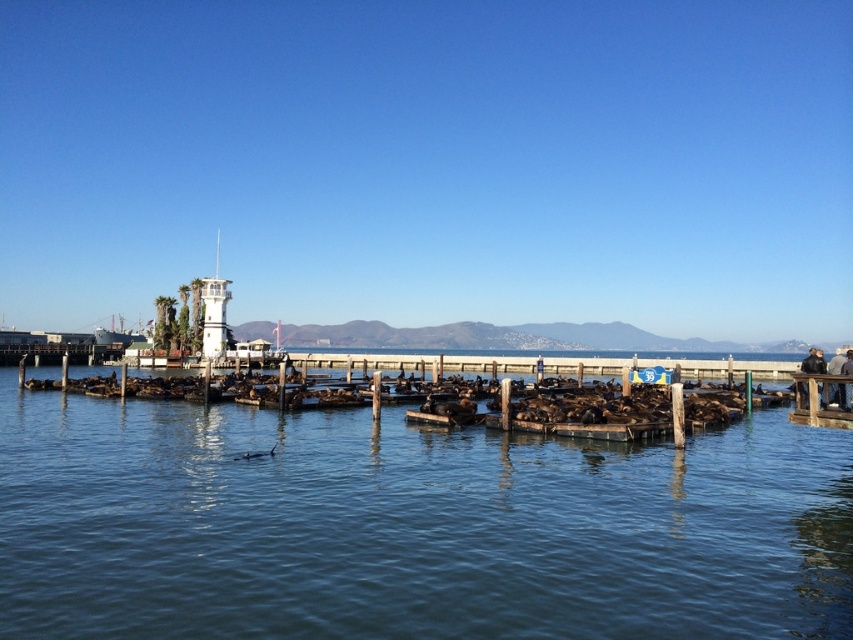
In the scene shown: How much distance is there between wooden dock at right and black leather jacket at lower right?

wooden dock at right is 48.60 meters from black leather jacket at lower right.

What do you see at coordinates (817, 403) in the screenshot? I see `wooden dock at right` at bounding box center [817, 403].

The image size is (853, 640). In order to click on wooden dock at right in this screenshot , I will do `click(817, 403)`.

Does white plastic tower at center have a larger size compared to black leather jacket at lower right?

No, white plastic tower at center is not bigger than black leather jacket at lower right.

Consider the image. Who is positioned more to the right, white plastic tower at center or black leather jacket at lower right?

From the viewer's perspective, black leather jacket at lower right appears more on the right side.

Between point (209, 312) and point (804, 388), which one is positioned behind?

Point (209, 312)

Find the location of a particular element. The height and width of the screenshot is (640, 853). white plastic tower at center is located at coordinates (213, 312).

Which of these two, clear blue water at center or black leather jacket at lower right, stands taller?

With more height is black leather jacket at lower right.

Does clear blue water at center have a greater width compared to black leather jacket at lower right?

In fact, clear blue water at center might be narrower than black leather jacket at lower right.

Who is more distant from viewer, (142, 522) or (814, 356)?

The point (814, 356) is behind.

Where is `clear blue water at center`? This screenshot has width=853, height=640. clear blue water at center is located at coordinates (410, 525).